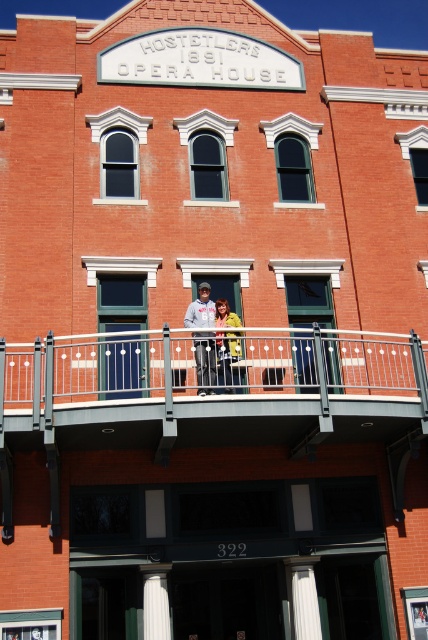
Is matte gray hoodie at center to the right of yellow matte jacket at center from the viewer's perspective?

Incorrect, matte gray hoodie at center is not on the right side of yellow matte jacket at center.

Who is positioned more to the right, matte gray hoodie at center or yellow matte jacket at center?

yellow matte jacket at center is more to the right.

What do you see at coordinates (214, 337) in the screenshot? This screenshot has height=640, width=428. I see `matte gray hoodie at center` at bounding box center [214, 337].

The image size is (428, 640). What are the coordinates of `matte gray hoodie at center` in the screenshot? It's located at (214, 337).

Is point (344, 410) positioned behind point (219, 301)?

No, it is not.

Is metallic gray railing at upper center wider than yellow matte jacket at center?

Yes.

Who is more distant from viewer, (x=267, y=352) or (x=219, y=378)?

The point (x=267, y=352) is behind.

Find the location of a particular element. This screenshot has height=640, width=428. metallic gray railing at upper center is located at coordinates (210, 387).

Is metallic gray railing at upper center to the right of white marble column at lower center from the viewer's perspective?

Correct, you'll find metallic gray railing at upper center to the right of white marble column at lower center.

Find the location of a particular element. This screenshot has width=428, height=640. metallic gray railing at upper center is located at coordinates (210, 387).